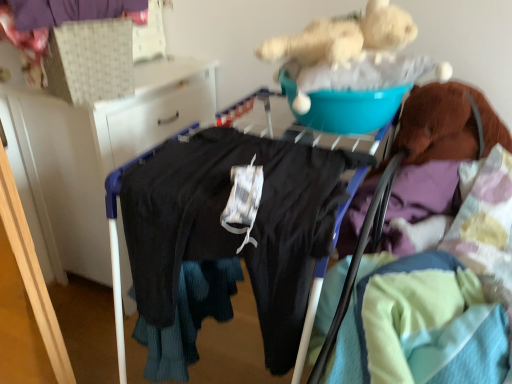
Locate an element on the screen. This screenshot has width=512, height=384. vacant area on top of black matte pants at center, placed as the second clothing when sorted from left to right (from a real-world perspective) is located at coordinates (251, 150).